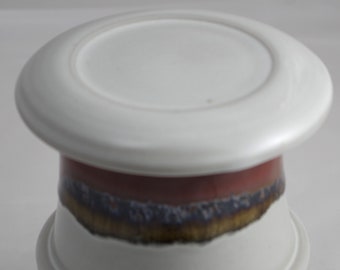
This screenshot has height=270, width=340. What are the coordinates of `white saucer` in the screenshot? It's located at (169, 82).